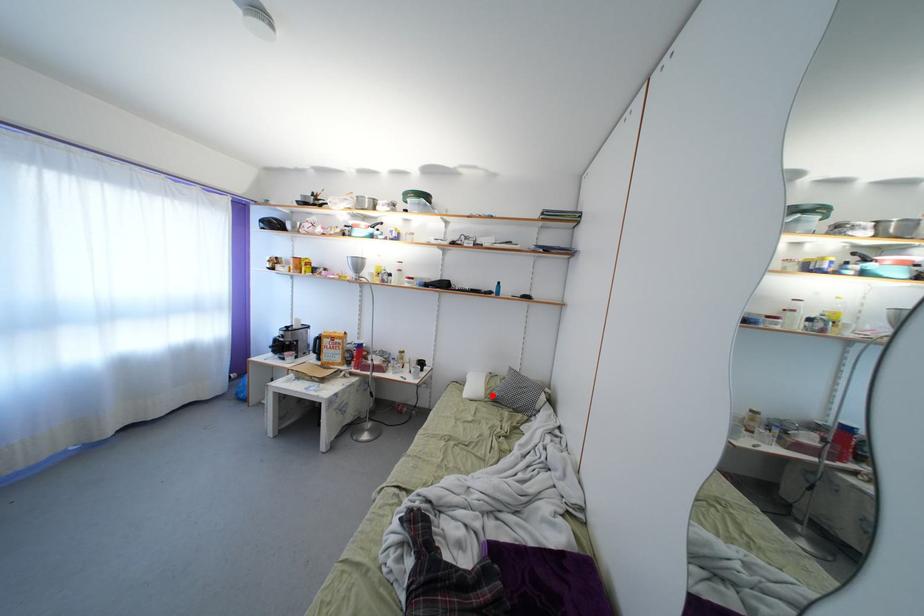
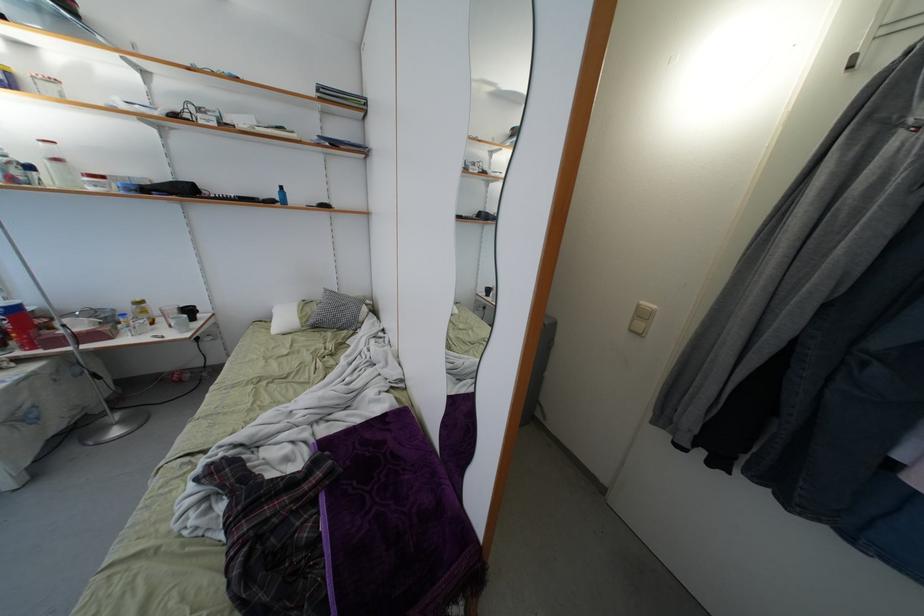
Question: I am providing you with two images of the same scene from different viewpoints. Image1 has a red point marked. In image2, the corresponding 3D location appears at what relative position? Reply with the corresponding letter.

Choices:
 (A) Closer
 (B) Farther

Answer: (A)